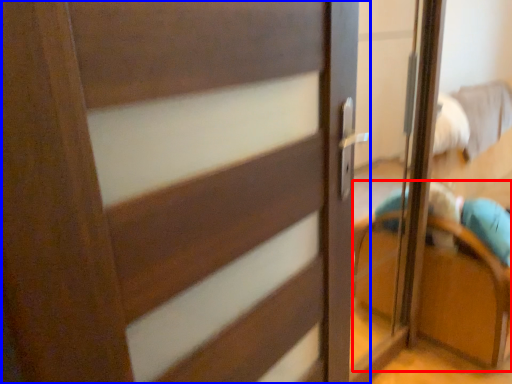
Question: Which object is further to the camera taking this photo, armchair (highlighted by a red box) or door (highlighted by a blue box)?

Choices:
 (A) armchair
 (B) door

Answer: (A)